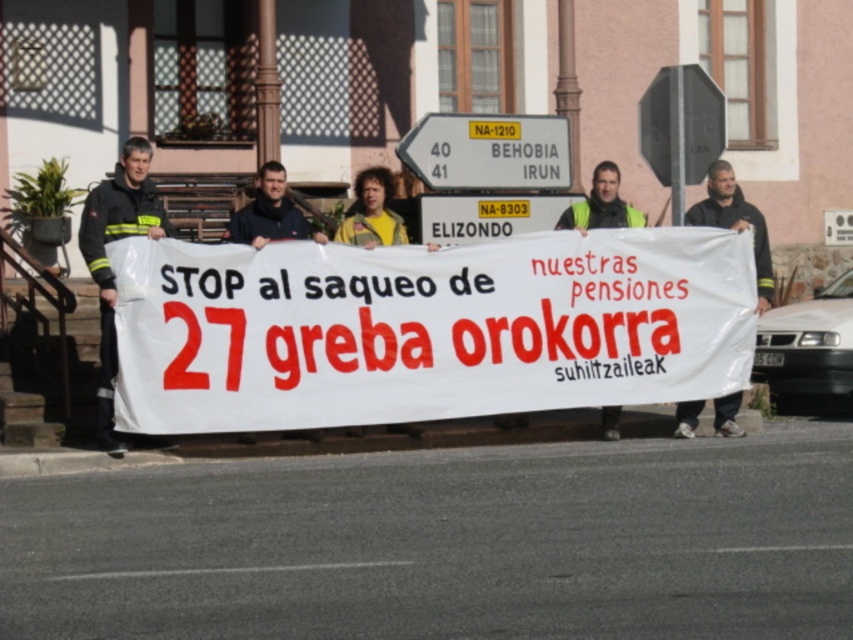
Is point (161, 440) in front of point (358, 221)?

Yes, it is in front of point (358, 221).

Is black uniform at left thinner than yellow fabric shirt at center?

In fact, black uniform at left might be wider than yellow fabric shirt at center.

Who is more forward, (x=129, y=148) or (x=373, y=188)?

Positioned in front is point (x=129, y=148).

Locate an element on the screen. Image resolution: width=853 pixels, height=640 pixels. black uniform at left is located at coordinates (107, 260).

Is yellow plastic sign at center above dark blue sweater at center?

Indeed, yellow plastic sign at center is positioned over dark blue sweater at center.

The image size is (853, 640). Describe the element at coordinates (486, 216) in the screenshot. I see `yellow plastic sign at center` at that location.

You are a GUI agent. You are given a task and a screenshot of the screen. Output one action in this format:
    pyautogui.click(x=<x>, y=<y>)
    Task: Click on the yellow plastic sign at center
    
    Given the screenshot: What is the action you would take?
    (x=486, y=216)

Between point (165, 228) and point (686, 76), which one is positioned in front?

Point (165, 228)

Does black uniform at left have a lesser width compared to black octagonal sign at upper center?

Yes, black uniform at left is thinner than black octagonal sign at upper center.

This screenshot has width=853, height=640. In order to click on black uniform at left in this screenshot , I will do `click(107, 260)`.